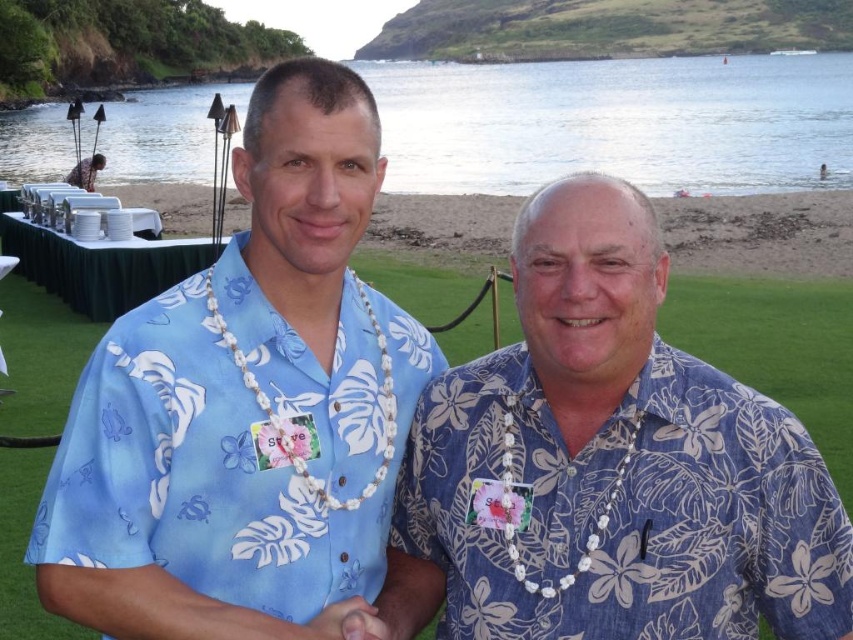
You are a photographer trying to capture a photo of the blue floral shirt at center and the clear water at beach left. Based on their positions, which object is closer to the left edge of the photo?

The blue floral shirt at center is positioned on the left side of clear water at beach left, so the blue floral shirt at center is closer to the left edge of the photo.

You are taking a photo of two men wearing Hawaiian shirts. You notice two points in the image at coordinates point (x=735, y=518) and point (x=392, y=209). Which point is nearer to your camera lens?

Point (x=735, y=518) is closer to the camera than point (x=392, y=209).

You are a photographer trying to capture the blue floral print shirt at center and the beach sand at lower center in a single shot. Which object is closer to the camera?

The blue floral print shirt at center is closer to the camera because it is not as tall as the beach sand at lower center, indicating it is positioned in front.